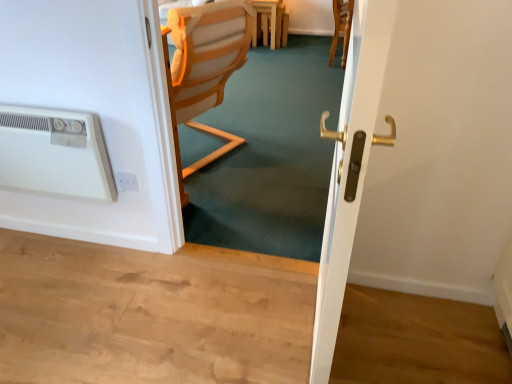
Question: From a real-world perspective, is white plastic air conditioning unit at left above or below wooden chair at center?

Choices:
 (A) above
 (B) below

Answer: (A)

Question: Choose the correct answer: Is white plastic air conditioning unit at left inside wooden chair at center or outside it?

Choices:
 (A) outside
 (B) inside

Answer: (A)

Question: Considering the real-world distances, which object is farthest from the wooden chair at center?

Choices:
 (A) white glossy door handle at center
 (B) white plastic air conditioning unit at left
 (C) white plastic electric outlet at lower left
 (D) light brown wooden table at center

Answer: (D)

Question: Estimate the real-world distances between objects in this image. Which object is farther from the light brown wooden table at center?

Choices:
 (A) wooden chair at center
 (B) white plastic air conditioning unit at left
 (C) white plastic electric outlet at lower left
 (D) white glossy door handle at center

Answer: (D)